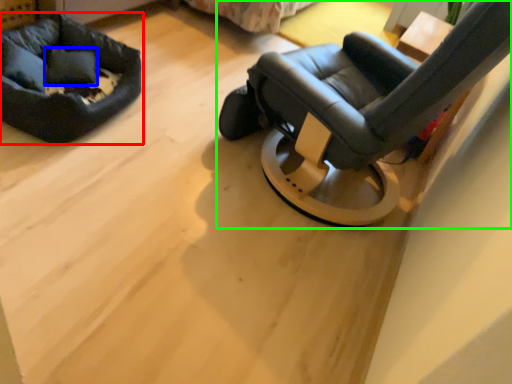
Question: Which object is the closest to the dog bed (highlighted by a red box)? Choose among these: pillow (highlighted by a blue box) or chair (highlighted by a green box).

Choices:
 (A) pillow
 (B) chair

Answer: (A)